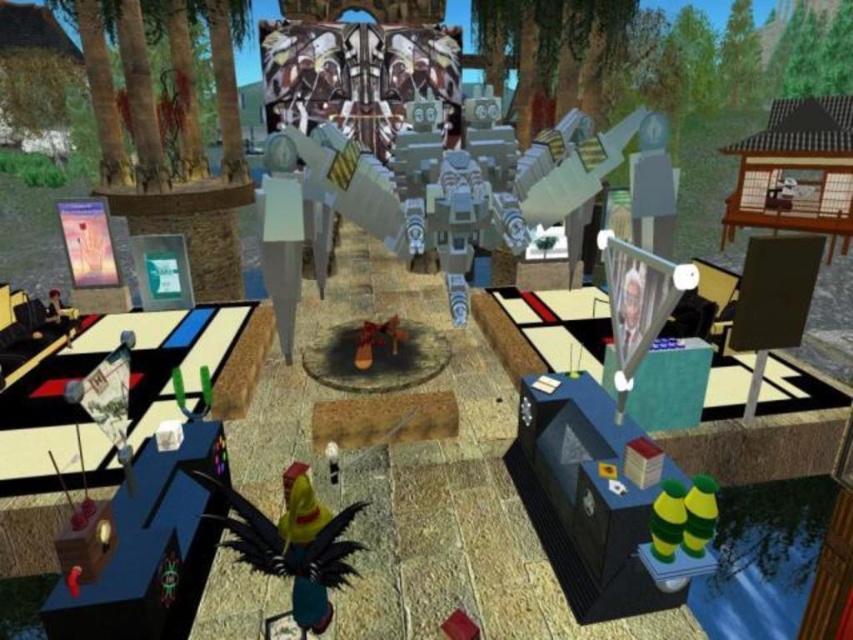
Locate an element on the screen. The height and width of the screenshot is (640, 853). shiny yellow toy at center is located at coordinates (292, 541).

How far apart are shiny yellow toy at center and metallic silver frame at upper right?

A distance of 7.61 feet exists between shiny yellow toy at center and metallic silver frame at upper right.

The width and height of the screenshot is (853, 640). What do you see at coordinates (292, 541) in the screenshot?
I see `shiny yellow toy at center` at bounding box center [292, 541].

Locate an element on the screen. The width and height of the screenshot is (853, 640). shiny yellow toy at center is located at coordinates (292, 541).

Is shiny yellow toy at center bigger than metallic silver poster at left?

Indeed, shiny yellow toy at center has a larger size compared to metallic silver poster at left.

Is shiny yellow toy at center wider than metallic silver poster at left?

Correct, the width of shiny yellow toy at center exceeds that of metallic silver poster at left.

Does point (367, 504) lie in front of point (74, 216)?

Yes.

The height and width of the screenshot is (640, 853). I want to click on shiny yellow toy at center, so click(x=292, y=541).

Does metallic silver frame at upper right have a greater width compared to metallic silver poster at left?

No.

Does metallic silver frame at upper right appear on the right side of metallic silver poster at left?

Correct, you'll find metallic silver frame at upper right to the right of metallic silver poster at left.

The image size is (853, 640). I want to click on metallic silver frame at upper right, so click(639, 300).